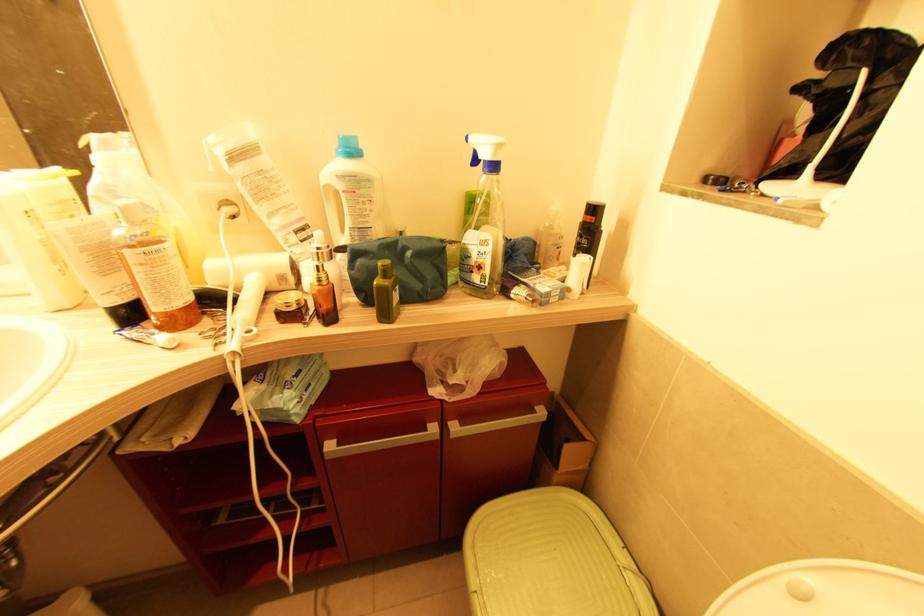
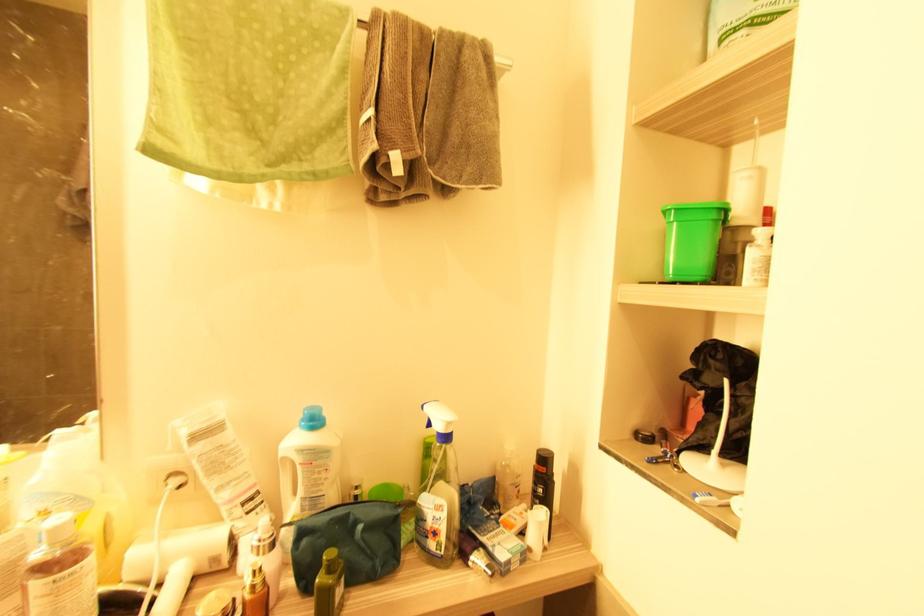
In the second image, find the point that corresponds to [594,219] in the first image.

(545, 469)